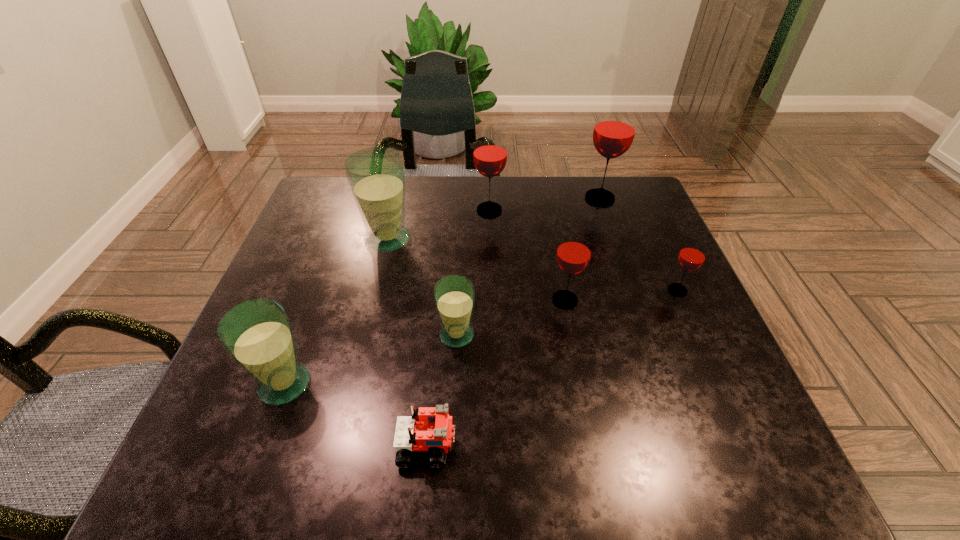
This screenshot has height=540, width=960. I want to click on object that can be found as the closest to the leftmost red glass, so click(376, 175).

Find the location of a particular element. object that ranks as the closest to the nearest glass is located at coordinates (430, 428).

Where is `glass that is the closest to the rightmost object`? The height and width of the screenshot is (540, 960). glass that is the closest to the rightmost object is located at coordinates (573, 255).

Locate an element on the screen. The image size is (960, 540). glass that is the closest to the third smallest red glass is located at coordinates (376, 175).

Locate an element on the screen. The image size is (960, 540). red glass that stands as the second closest to the rightmost glass is located at coordinates (614, 131).

Locate which red glass is the third closest to the Lego. Please provide its 2D coordinates. Your answer should be formatted as a tuple, i.e. [(x, y)], where the tuple contains the x and y coordinates of a point satisfying the conditions above.

[(490, 154)]

Point out which blue glass is positioned as the second nearest to the third farthest glass. Please provide its 2D coordinates. Your answer should be formatted as a tuple, i.e. [(x, y)], where the tuple contains the x and y coordinates of a point satisfying the conditions above.

[(257, 334)]

Where is `blue glass that stands as the second closest to the rightmost object`? This screenshot has height=540, width=960. blue glass that stands as the second closest to the rightmost object is located at coordinates (376, 175).

Where is `free space in the image that satisfies the following two spatial constraints: 1. on the front side of the rightmost glass; 2. on the right side of the second biggest red glass`? This screenshot has height=540, width=960. free space in the image that satisfies the following two spatial constraints: 1. on the front side of the rightmost glass; 2. on the right side of the second biggest red glass is located at coordinates (492, 290).

Find the location of a particular element. vacant region that satisfies the following two spatial constraints: 1. on the back side of the leftmost blue glass; 2. on the left side of the biggest blue glass is located at coordinates (338, 239).